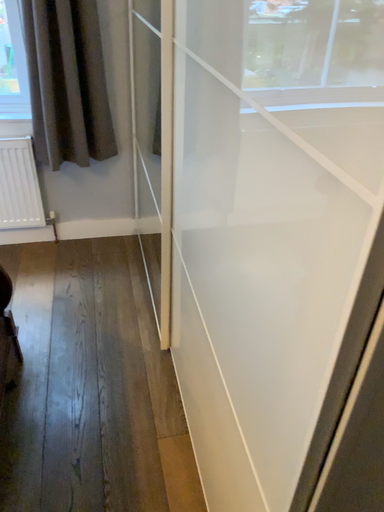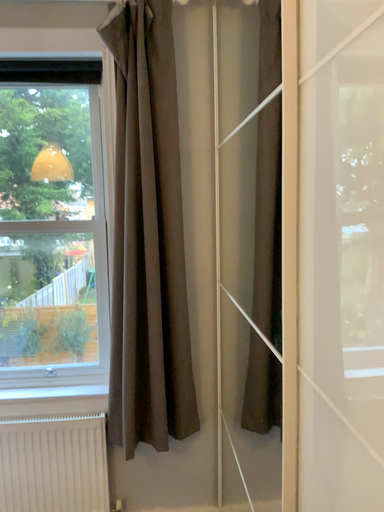
Question: How did the camera likely rotate when shooting the video?

Choices:
 (A) rotated right
 (B) rotated left

Answer: (B)